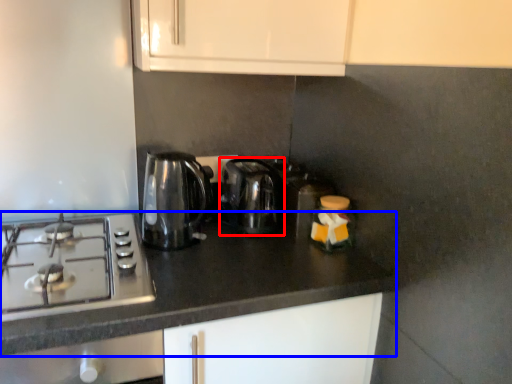
Question: Which object is closer to the camera taking this photo, kitchen appliance (highlighted by a red box) or countertop (highlighted by a blue box)?

Choices:
 (A) kitchen appliance
 (B) countertop

Answer: (B)